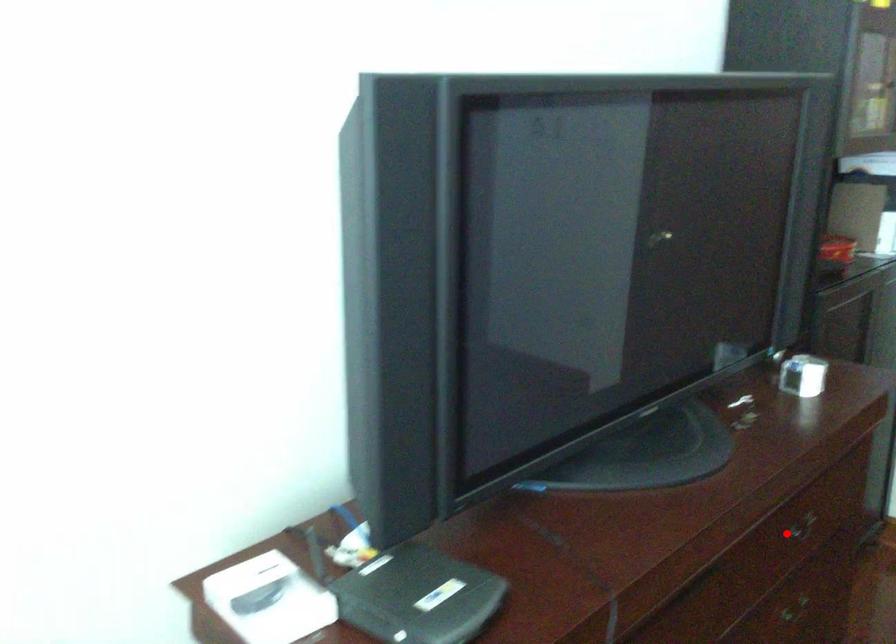
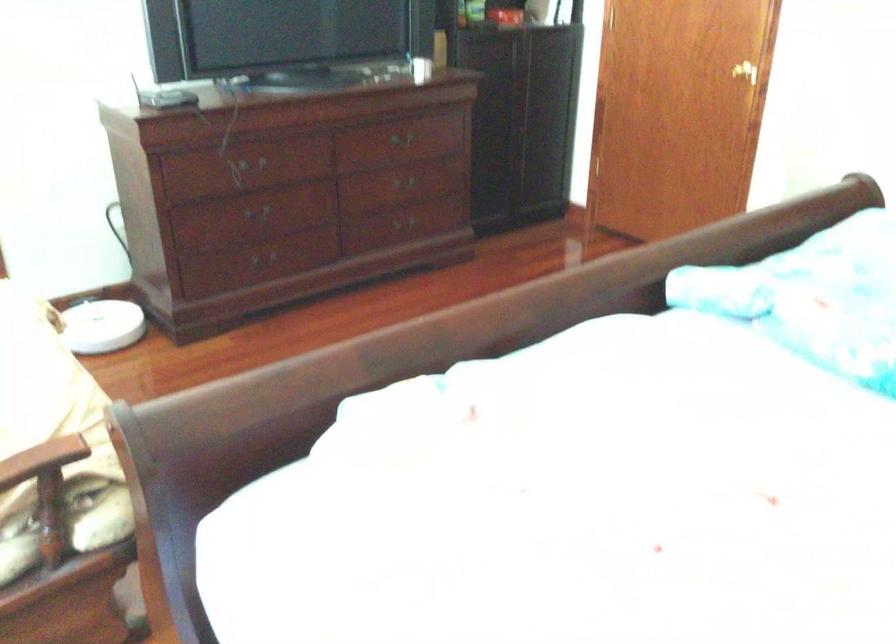
Find the pixel in the second image that matches the highlighted location in the first image.

(401, 138)